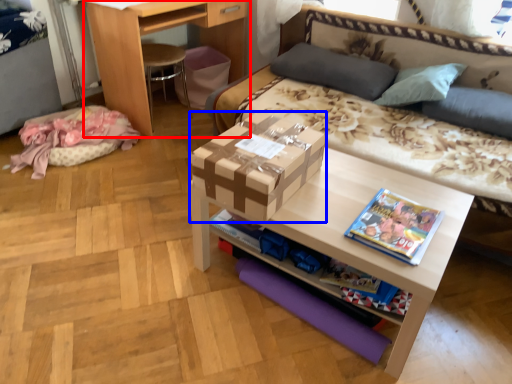
Question: Among these objects, which one is nearest to the camera, desk (highlighted by a red box) or box (highlighted by a blue box)?

Choices:
 (A) desk
 (B) box

Answer: (B)